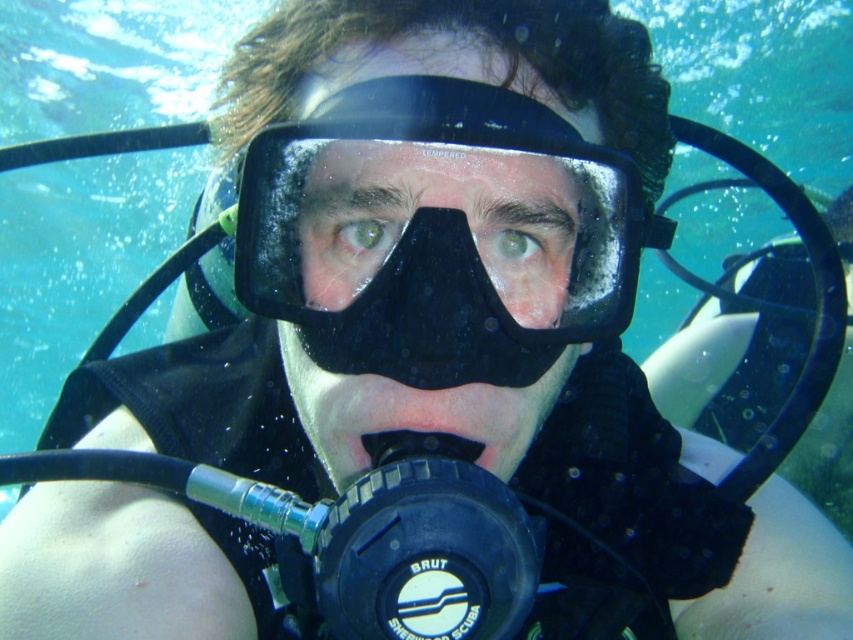
Is black matte scuba mask at center below black rubber mouthpiece at center?

No, black matte scuba mask at center is not below black rubber mouthpiece at center.

The height and width of the screenshot is (640, 853). Identify the location of black matte scuba mask at center. (434, 230).

Between point (416, 157) and point (450, 448), which one is positioned behind?

Point (450, 448)

Find the location of `black matte scuba mask at center`. black matte scuba mask at center is located at coordinates (434, 230).

Does matte black nose at center have a greater height compared to black rubber mouthpiece at center?

Yes.

Is point (556, 321) in front of point (439, 445)?

No, (556, 321) is further to viewer.

What do you see at coordinates (532, 292) in the screenshot? The image size is (853, 640). I see `matte black nose at center` at bounding box center [532, 292].

The width and height of the screenshot is (853, 640). Identify the location of matte black nose at center. (532, 292).

Locate an element on the screen. black matte scuba mask at center is located at coordinates (434, 230).

Between black matte scuba mask at center and matte black nose at center, which one appears on the left side from the viewer's perspective?

black matte scuba mask at center

This screenshot has width=853, height=640. What do you see at coordinates (434, 230) in the screenshot? I see `black matte scuba mask at center` at bounding box center [434, 230].

This screenshot has height=640, width=853. Identify the location of black matte scuba mask at center. (434, 230).